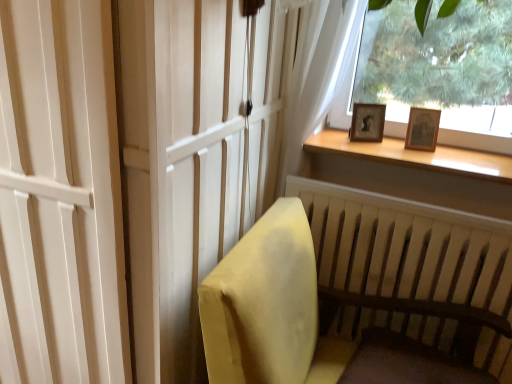
Question: Is wooden frame at upper right located within dark wood footrest at lower right?

Choices:
 (A) no
 (B) yes

Answer: (A)

Question: Is dark wood footrest at lower right facing towards wooden frame at upper right?

Choices:
 (A) no
 (B) yes

Answer: (A)

Question: Is the position of dark wood footrest at lower right less distant than that of wooden frame at upper right?

Choices:
 (A) yes
 (B) no

Answer: (A)

Question: Is dark wood footrest at lower right smaller than wooden frame at upper right?

Choices:
 (A) no
 (B) yes

Answer: (B)

Question: From the image's perspective, is dark wood footrest at lower right under wooden frame at upper right?

Choices:
 (A) no
 (B) yes

Answer: (B)

Question: In terms of height, does wooden frame at upper right look taller or shorter compared to wooden photo frame at upper right?

Choices:
 (A) tall
 (B) short

Answer: (A)

Question: From a real-world perspective, is wooden frame at upper right physically located above or below wooden photo frame at upper right?

Choices:
 (A) above
 (B) below

Answer: (A)

Question: From the image's perspective, is wooden frame at upper right above or below wooden photo frame at upper right?

Choices:
 (A) below
 (B) above

Answer: (B)

Question: Is wooden frame at upper right bigger or smaller than wooden photo frame at upper right?

Choices:
 (A) big
 (B) small

Answer: (A)

Question: Is point (32, 256) closer or farther from the camera than point (369, 347)?

Choices:
 (A) farther
 (B) closer

Answer: (B)

Question: Considering the positions of white matte screen door at left and dark wood footrest at lower right in the image, is white matte screen door at left taller or shorter than dark wood footrest at lower right?

Choices:
 (A) short
 (B) tall

Answer: (B)

Question: Is white matte screen door at left in front of or behind dark wood footrest at lower right in the image?

Choices:
 (A) behind
 (B) front

Answer: (B)

Question: Considering the positions of white matte screen door at left and dark wood footrest at lower right in the image, is white matte screen door at left wider or thinner than dark wood footrest at lower right?

Choices:
 (A) wide
 (B) thin

Answer: (B)

Question: Is point (267, 294) positioned closer to the camera than point (371, 107)?

Choices:
 (A) farther
 (B) closer

Answer: (B)

Question: From the image's perspective, relative to wooden photo frame at upper right, is velvet yellow chair at lower right above or below?

Choices:
 (A) above
 (B) below

Answer: (B)